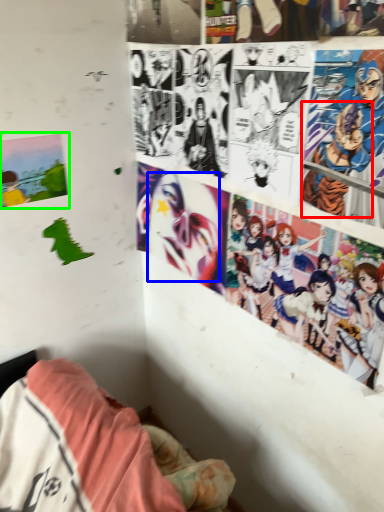
Question: Which object is positioned farthest from person (highlighted by a red box)? Select from human face (highlighted by a blue box) and poster page (highlighted by a green box).

Choices:
 (A) human face
 (B) poster page

Answer: (B)